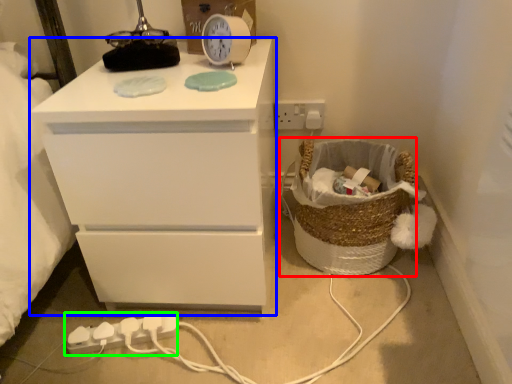
Question: Which object is positioned farthest from basket (highlighted by a red box)? Select from chest of drawers (highlighted by a blue box) and extension cord (highlighted by a green box).

Choices:
 (A) chest of drawers
 (B) extension cord

Answer: (B)